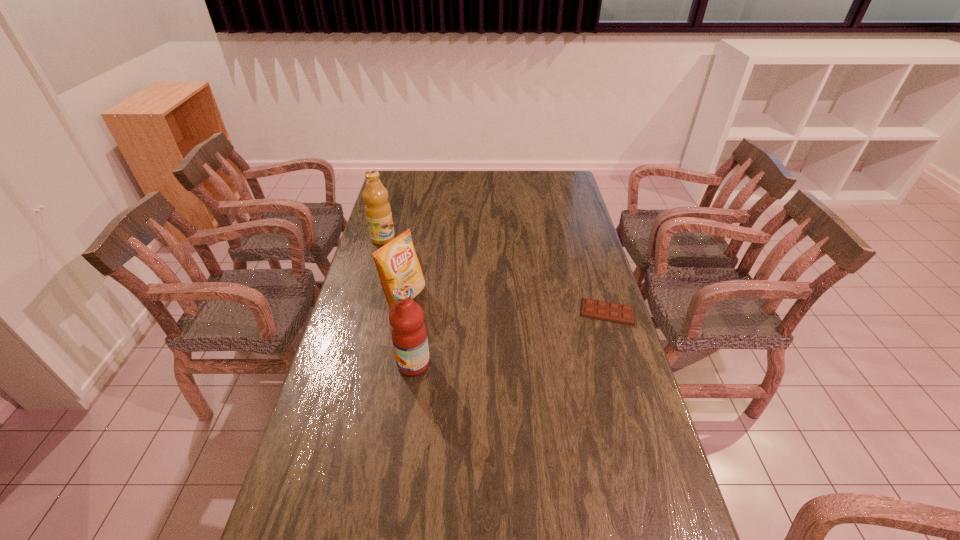
The image size is (960, 540). In order to click on free space at the left edge in this screenshot , I will do `click(372, 350)`.

This screenshot has height=540, width=960. In order to click on free space at the right edge of the desktop in this screenshot , I will do `click(577, 238)`.

Where is `vacant region at the far left corner of the desktop`? This screenshot has height=540, width=960. vacant region at the far left corner of the desktop is located at coordinates (397, 179).

Locate an element on the screen. Image resolution: width=960 pixels, height=540 pixels. vacant space at the near left corner of the desktop is located at coordinates (311, 523).

At what (x,y) coordinates should I click in order to perform the action: click on unoccupied position between the olive oil and the chocolate bar. Please return your answer as a coordinate pair (x, y). This screenshot has width=960, height=540. Looking at the image, I should click on (495, 275).

Find the location of a particular element. vacant space in between the chocolate bar and the nearest object is located at coordinates (511, 338).

I want to click on empty location between the olive oil and the shortest object, so click(495, 275).

Locate an element on the screen. The width and height of the screenshot is (960, 540). empty space that is in between the nearest object and the rightmost object is located at coordinates (511, 338).

Identify the location of free space between the nearest object and the chocolate bar. (511, 338).

The width and height of the screenshot is (960, 540). I want to click on free space between the rightmost object and the third tallest object, so click(506, 305).